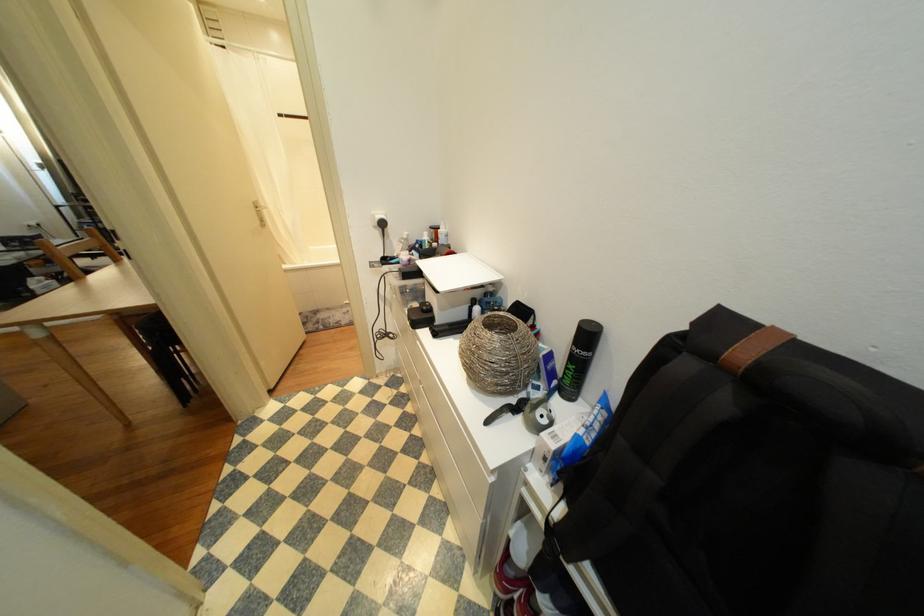
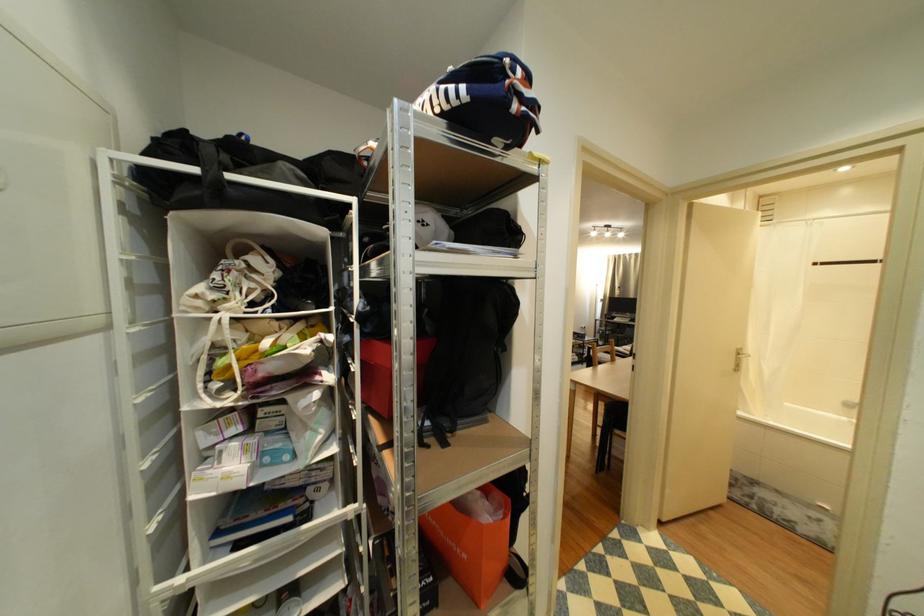
Question: Based on the continuous images, in which direction is the camera rotating? Reply with the corresponding letter.

Choices:
 (A) Left
 (B) Right
 (C) Up
 (D) Down

Answer: (A)